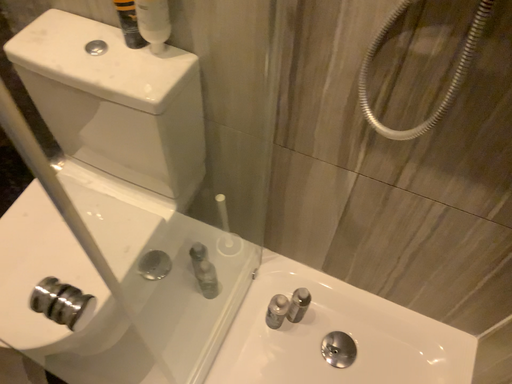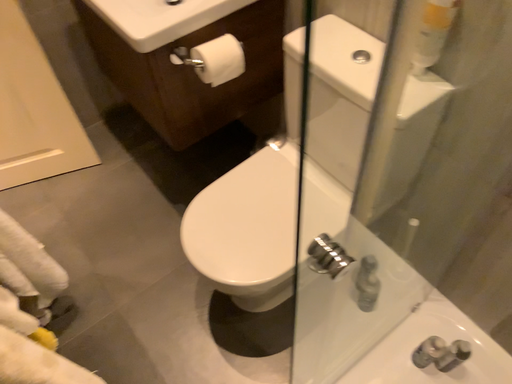
Question: Which way did the camera rotate in the video?

Choices:
 (A) rotated right
 (B) rotated left

Answer: (B)